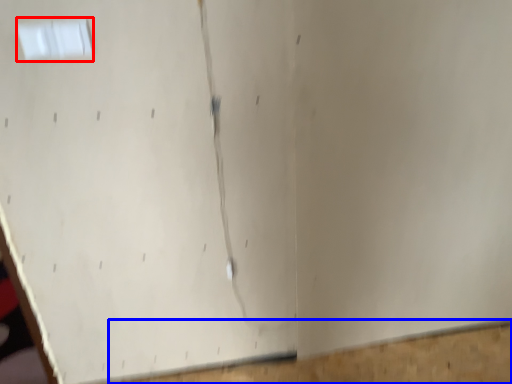
Question: Which object is closer to the camera taking this photo, window (highlighted by a red box) or plywood (highlighted by a blue box)?

Choices:
 (A) window
 (B) plywood

Answer: (A)